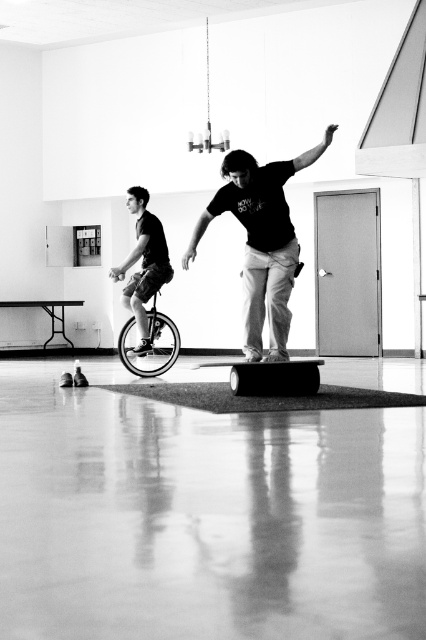
Question: Which point is farther to the camera?

Choices:
 (A) shiny metallic unicycle at center
 (B) smooth wood skateboard at center
 (C) matte black unicycle at left
 (D) smooth rubber skateboard at center

Answer: (A)

Question: Is matte black unicycle at left wider than smooth rubber skateboard at center?

Choices:
 (A) yes
 (B) no

Answer: (B)

Question: Is matte black unicycle at left to the left of smooth rubber skateboard at center from the viewer's perspective?

Choices:
 (A) no
 (B) yes

Answer: (B)

Question: Estimate the real-world distances between objects in this image. Which object is farther from the matte black unicycle at left?

Choices:
 (A) smooth wood skateboard at center
 (B) smooth rubber skateboard at center

Answer: (A)

Question: Which of the following is the closest to the observer?

Choices:
 (A) matte black unicycle at left
 (B) shiny metallic unicycle at center
 (C) smooth wood skateboard at center

Answer: (C)

Question: Does smooth wood skateboard at center appear on the left side of matte black unicycle at left?

Choices:
 (A) yes
 (B) no

Answer: (B)